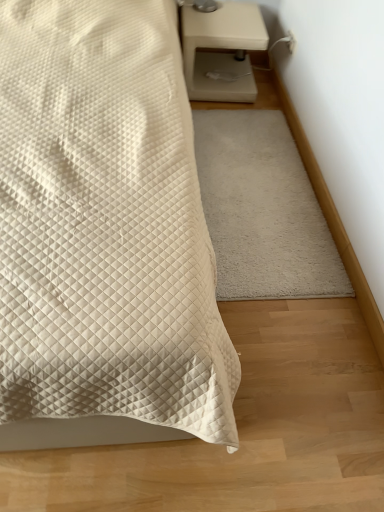
Question: Should I look upward or downward to see white soft rug at center?

Choices:
 (A) up
 (B) down

Answer: (A)

Question: Is white soft rug at center far away from white quilted bed at center?

Choices:
 (A) no
 (B) yes

Answer: (A)

Question: Is white soft rug at center looking in the opposite direction of white quilted bed at center?

Choices:
 (A) yes
 (B) no

Answer: (B)

Question: Does white soft rug at center have a lesser height compared to white quilted bed at center?

Choices:
 (A) yes
 (B) no

Answer: (A)

Question: Does white soft rug at center come in front of white quilted bed at center?

Choices:
 (A) yes
 (B) no

Answer: (B)

Question: Is white soft rug at center positioned beyond the bounds of white quilted bed at center?

Choices:
 (A) yes
 (B) no

Answer: (A)

Question: Does white soft rug at center turn towards white quilted bed at center?

Choices:
 (A) yes
 (B) no

Answer: (B)

Question: Is white quilted bed at center further to camera compared to beige matte nightstand at upper right?

Choices:
 (A) yes
 (B) no

Answer: (B)

Question: From a real-world perspective, is white quilted bed at center positioned under beige matte nightstand at upper right based on gravity?

Choices:
 (A) no
 (B) yes

Answer: (A)

Question: Is white quilted bed at center directly adjacent to beige matte nightstand at upper right?

Choices:
 (A) yes
 (B) no

Answer: (B)

Question: From a real-world perspective, is white quilted bed at center physically above beige matte nightstand at upper right?

Choices:
 (A) no
 (B) yes

Answer: (B)

Question: Considering the relative sizes of white quilted bed at center and beige matte nightstand at upper right in the image provided, is white quilted bed at center thinner than beige matte nightstand at upper right?

Choices:
 (A) yes
 (B) no

Answer: (B)

Question: Is white quilted bed at center facing towards beige matte nightstand at upper right?

Choices:
 (A) no
 (B) yes

Answer: (A)

Question: Considering the relative sizes of white quilted bed at center and white soft rug at center in the image provided, is white quilted bed at center wider than white soft rug at center?

Choices:
 (A) no
 (B) yes

Answer: (B)